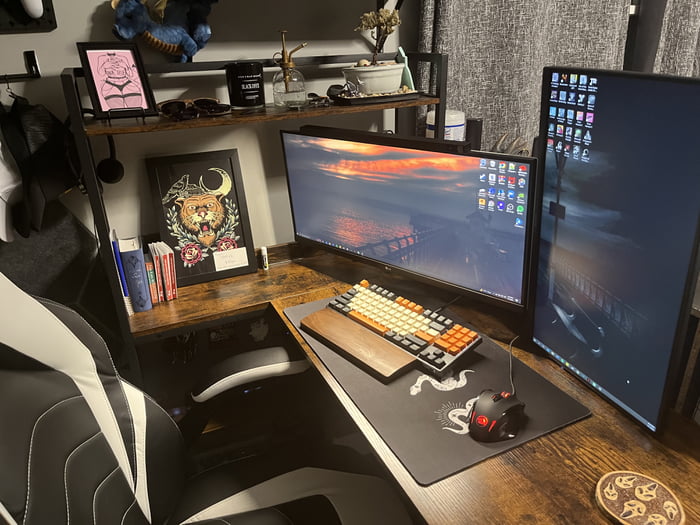
The height and width of the screenshot is (525, 700). Find the location of `computer monitors`. computer monitors is located at coordinates (412, 206), (606, 220).